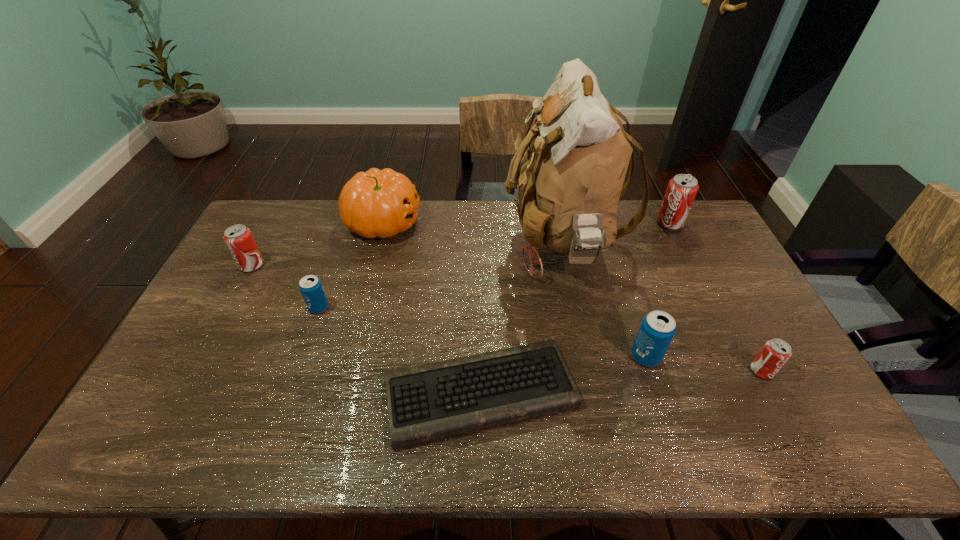
The width and height of the screenshot is (960, 540). Find the location of `blank space located 0.170m on the left of the smallest pink soda can`. blank space located 0.170m on the left of the smallest pink soda can is located at coordinates [x=687, y=371].

Where is `vacant space located on the right of the fourth nearest object`? vacant space located on the right of the fourth nearest object is located at coordinates (428, 308).

Locate an element on the screen. free point located 0.200m on the left of the computer keyboard is located at coordinates (305, 393).

Where is `backpack present at the far edge`? The height and width of the screenshot is (540, 960). backpack present at the far edge is located at coordinates (x=570, y=181).

Find the location of `pumpkin present at the far edge`. pumpkin present at the far edge is located at coordinates (378, 203).

The image size is (960, 540). What are the coordinates of `soda can at the far edge` in the screenshot? It's located at (681, 191).

The height and width of the screenshot is (540, 960). I want to click on object present at the near edge, so [x=435, y=401].

What are the coordinates of `object at the left edge` in the screenshot? It's located at 238,238.

Locate an element on the screen. The height and width of the screenshot is (540, 960). object that is at the far right corner is located at coordinates (681, 191).

This screenshot has width=960, height=540. Find the location of `vacant space at the far edge of the desktop`. vacant space at the far edge of the desktop is located at coordinates (488, 211).